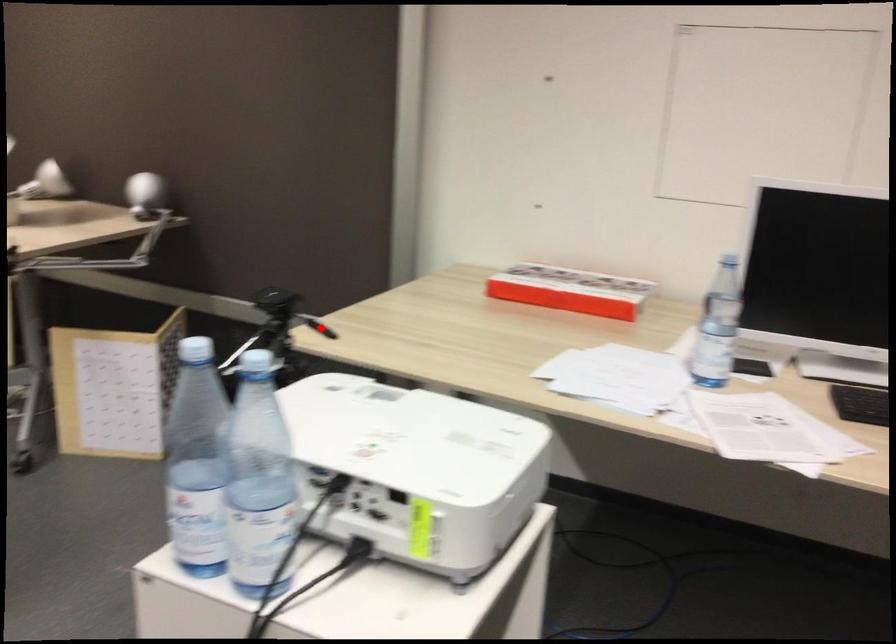
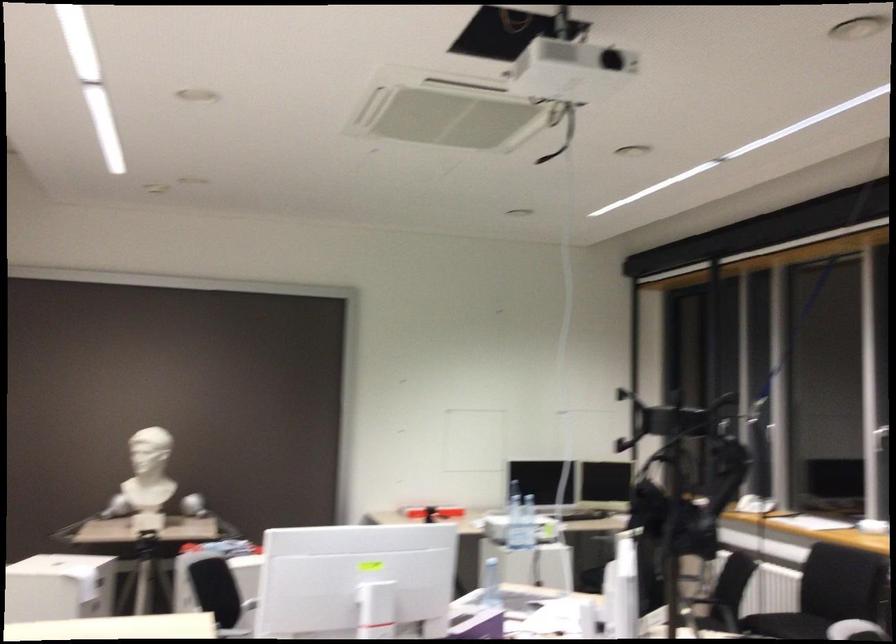
Question: I am providing you with two images of the same scene from different viewpoints. A red point is marked on the first image. Is the red point's position out of view in image 2?

Choices:
 (A) Yes
 (B) No

Answer: (A)